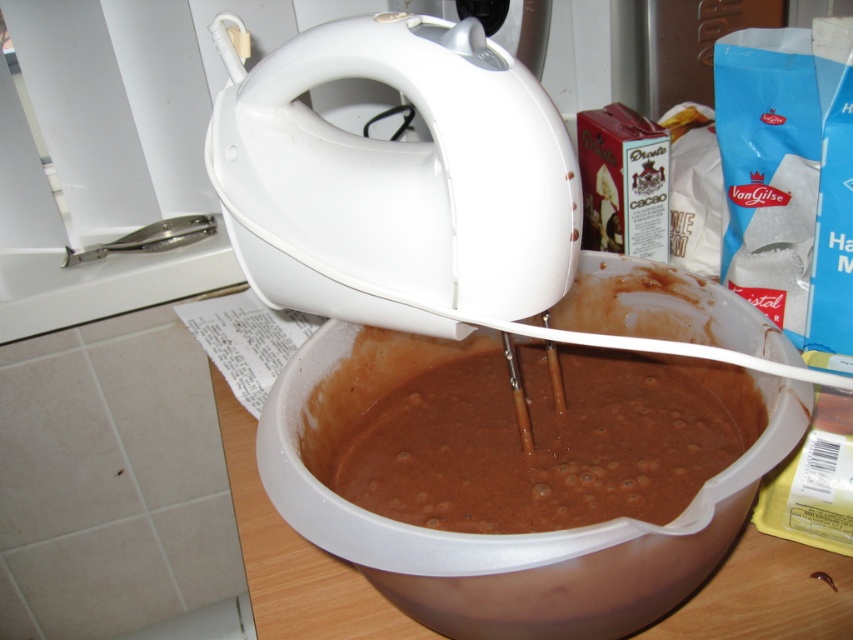
Question: Which point is farther to the camera?

Choices:
 (A) (485, 248)
 (B) (305, 419)

Answer: (B)

Question: Does brown matte plastic bowl at center have a larger size compared to chocolate matte batter at center?

Choices:
 (A) yes
 (B) no

Answer: (A)

Question: Is white plastic mixer at upper center to the left of brown matte plastic bowl at center from the viewer's perspective?

Choices:
 (A) no
 (B) yes

Answer: (B)

Question: Which object is positioned farthest from the white plastic mixer at upper center?

Choices:
 (A) brown matte plastic bowl at center
 (B) chocolate matte batter at center

Answer: (B)

Question: Is white plastic mixer at upper center smaller than chocolate matte batter at center?

Choices:
 (A) yes
 (B) no

Answer: (A)

Question: Which of the following is the closest to the observer?

Choices:
 (A) chocolate matte batter at center
 (B) brown matte plastic bowl at center
 (C) white plastic mixer at upper center

Answer: (B)